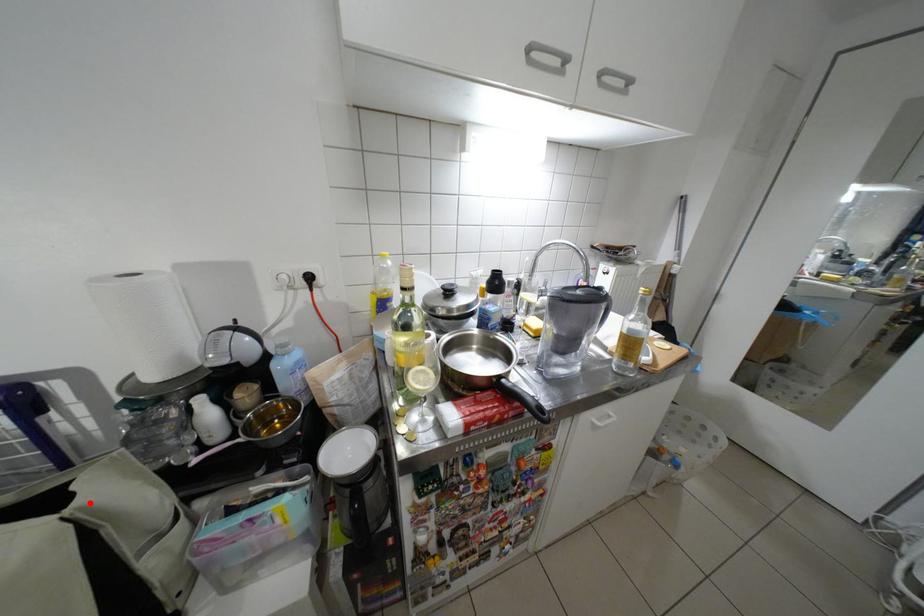
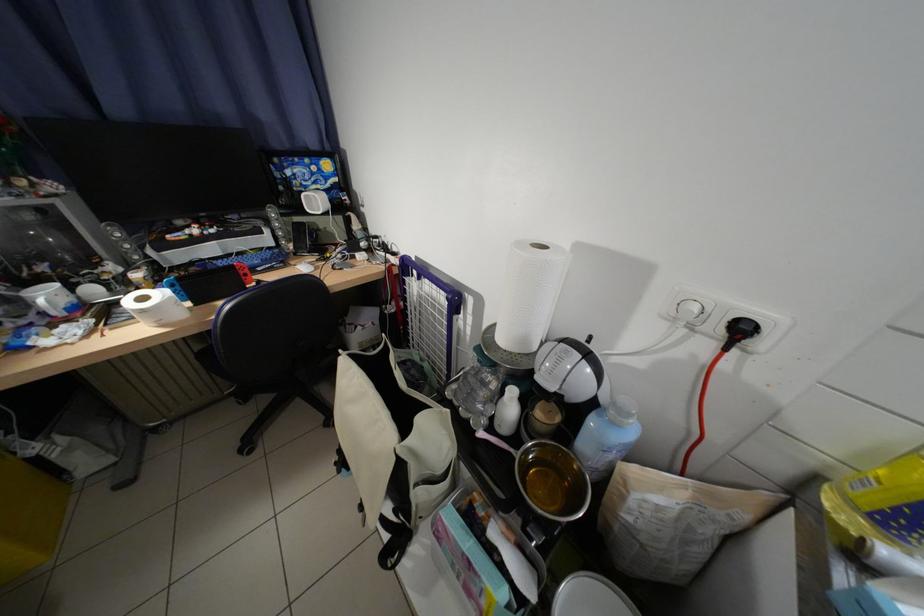
Question: A red point is marked in image1. In image2, is the corresponding 3D point closer to the camera or farther? Reply with the corresponding letter.

Choices:
 (A) The corresponding 3D point is closer.
 (B) The corresponding 3D point is farther.

Answer: (B)